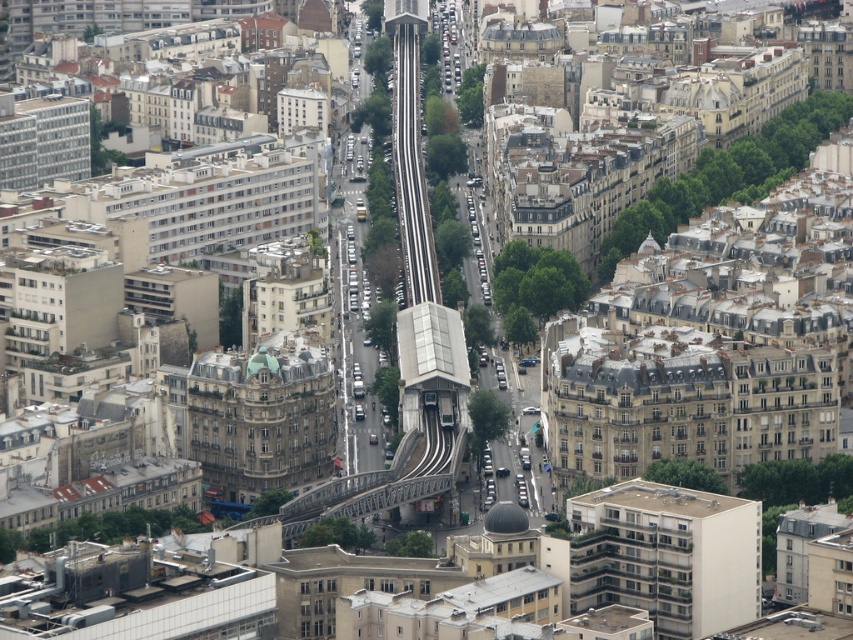
Question: Does white smooth building at center have a smaller size compared to black rubber train track at center?

Choices:
 (A) yes
 (B) no

Answer: (A)

Question: Considering the relative positions of white smooth building at center and black rubber train track at center in the image provided, where is white smooth building at center located with respect to black rubber train track at center?

Choices:
 (A) above
 (B) below

Answer: (B)

Question: Which point is farther from the camera taking this photo?

Choices:
 (A) (416, 256)
 (B) (633, 545)

Answer: (A)

Question: Considering the relative positions of white smooth building at center and black rubber train track at center in the image provided, where is white smooth building at center located with respect to black rubber train track at center?

Choices:
 (A) below
 (B) above

Answer: (A)